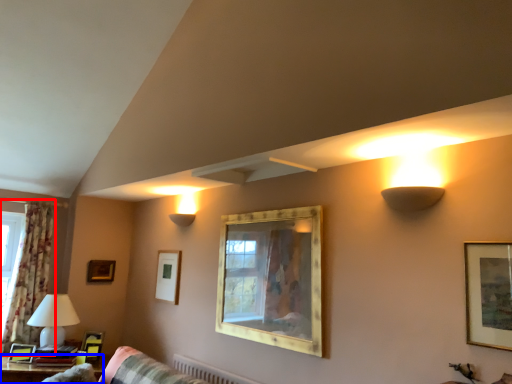
Question: Which point is further to the camera, window (highlighted by a red box) or table (highlighted by a blue box)?

Choices:
 (A) window
 (B) table

Answer: (A)